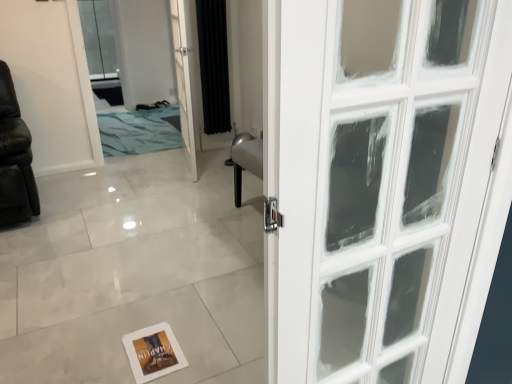
Question: Can you confirm if blue fabric bed at upper left is taller than black fabric curtain at center?

Choices:
 (A) yes
 (B) no

Answer: (A)

Question: Is blue fabric bed at upper left behind black fabric curtain at center?

Choices:
 (A) yes
 (B) no

Answer: (B)

Question: Can you confirm if blue fabric bed at upper left is bigger than black fabric curtain at center?

Choices:
 (A) no
 (B) yes

Answer: (B)

Question: Is the surface of blue fabric bed at upper left in direct contact with black fabric curtain at center?

Choices:
 (A) no
 (B) yes

Answer: (A)

Question: Considering the relative sizes of blue fabric bed at upper left and black fabric curtain at center in the image provided, is blue fabric bed at upper left thinner than black fabric curtain at center?

Choices:
 (A) yes
 (B) no

Answer: (A)

Question: From the image's perspective, would you say blue fabric bed at upper left is positioned over black fabric curtain at center?

Choices:
 (A) no
 (B) yes

Answer: (A)

Question: Can you confirm if black fabric curtain at center is bigger than white paper postcard at lower center?

Choices:
 (A) yes
 (B) no

Answer: (A)

Question: Does black fabric curtain at center have a lesser width compared to white paper postcard at lower center?

Choices:
 (A) yes
 (B) no

Answer: (A)

Question: Is black fabric curtain at center with white paper postcard at lower center?

Choices:
 (A) yes
 (B) no

Answer: (B)

Question: From the image's perspective, does black fabric curtain at center appear lower than white paper postcard at lower center?

Choices:
 (A) yes
 (B) no

Answer: (B)

Question: Is black fabric curtain at center taller than white paper postcard at lower center?

Choices:
 (A) yes
 (B) no

Answer: (A)

Question: Is black fabric curtain at center completely or partially outside of white paper postcard at lower center?

Choices:
 (A) yes
 (B) no

Answer: (A)

Question: Can you confirm if black fabric curtain at center is thinner than white glass door at center?

Choices:
 (A) no
 (B) yes

Answer: (B)